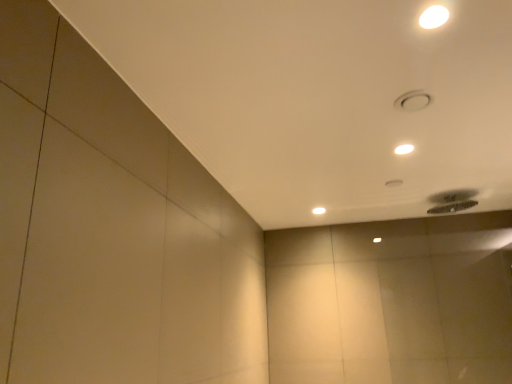
Question: From the image's perspective, is white glossy lamp at upper right, which is the second lamp in right-to-left order, on top of white glossy lamp at upper right, which appears as the 2th lamp when ordered from the bottom?

Choices:
 (A) no
 (B) yes

Answer: (B)

Question: Would you say white glossy lamp at upper right, marked as the third lamp in a back-to-front arrangement, is outside white glossy lamp at upper right, the first lamp in the right-to-left sequence?

Choices:
 (A) no
 (B) yes

Answer: (B)

Question: Does white glossy lamp at upper right, the 1th lamp positioned from the front, have a larger size compared to white glossy lamp at upper right, which appears as the 2th lamp when ordered from the bottom?

Choices:
 (A) no
 (B) yes

Answer: (A)

Question: Is white glossy lamp at upper right, placed as the first lamp when sorted from top to bottom, further to camera compared to white glossy lamp at upper right, which appears as the 2th lamp when ordered from the bottom?

Choices:
 (A) no
 (B) yes

Answer: (A)

Question: Is white glossy lamp at upper right, which is the second lamp in right-to-left order, at the right side of white glossy lamp at upper right, which is the 2th lamp in back-to-front order?

Choices:
 (A) yes
 (B) no

Answer: (B)

Question: Is white glossy lamp at upper right, which appears as the 3th lamp when ordered from the bottom, shorter than white glossy lamp at upper right, which is the 2th lamp in back-to-front order?

Choices:
 (A) no
 (B) yes

Answer: (A)

Question: Can you confirm if white glossy lamp at upper right, the first lamp in the right-to-left sequence, is shorter than white glossy lamp at upper center, the third lamp positioned from the right?

Choices:
 (A) no
 (B) yes

Answer: (B)

Question: Can you confirm if white glossy lamp at upper right, the second lamp from the top, is smaller than white glossy lamp at upper center, the third lamp in the front-to-back sequence?

Choices:
 (A) yes
 (B) no

Answer: (A)

Question: Is white glossy lamp at upper right, the second lamp from the top, wider than white glossy lamp at upper center, the third lamp in the front-to-back sequence?

Choices:
 (A) yes
 (B) no

Answer: (B)

Question: Is white glossy lamp at upper right, the second lamp from the top, at the right side of white glossy lamp at upper center, which appears as the third lamp when viewed from the top?

Choices:
 (A) yes
 (B) no

Answer: (A)

Question: Can you confirm if white glossy lamp at upper right, the first lamp in the right-to-left sequence, is bigger than white glossy lamp at upper center, the 1th lamp positioned from the left?

Choices:
 (A) no
 (B) yes

Answer: (A)

Question: From a real-world perspective, is white glossy lamp at upper right, which appears as the 2th lamp when ordered from the bottom, below white glossy lamp at upper center, the third lamp positioned from the right?

Choices:
 (A) yes
 (B) no

Answer: (B)

Question: From the image's perspective, would you say white glossy lamp at upper right, the 3th lamp positioned from the left, is positioned over white glossy lamp at upper right, which appears as the 3th lamp when ordered from the bottom?

Choices:
 (A) yes
 (B) no

Answer: (B)